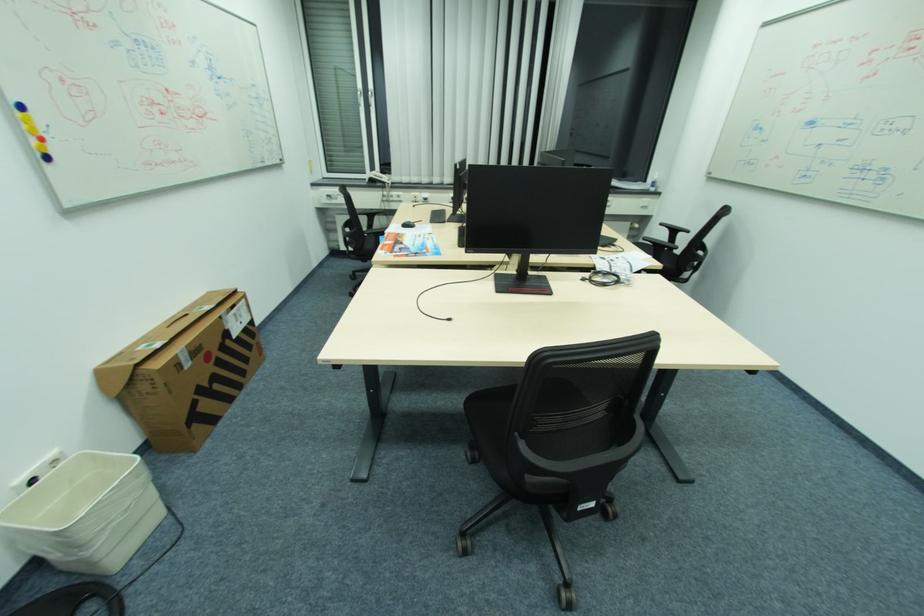
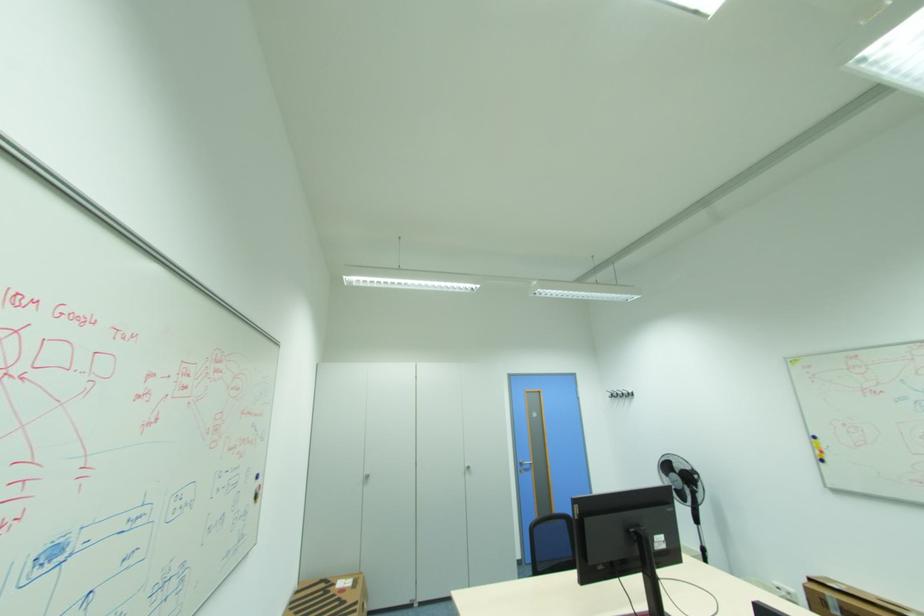
The point at (x=37, y=140) is marked in the first image. Where is the corresponding point in the second image?

(822, 453)